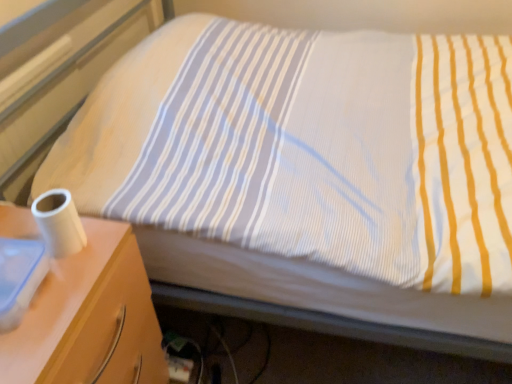
The image size is (512, 384). Identify the location of free spot in front of white matte toilet paper at left. (56, 302).